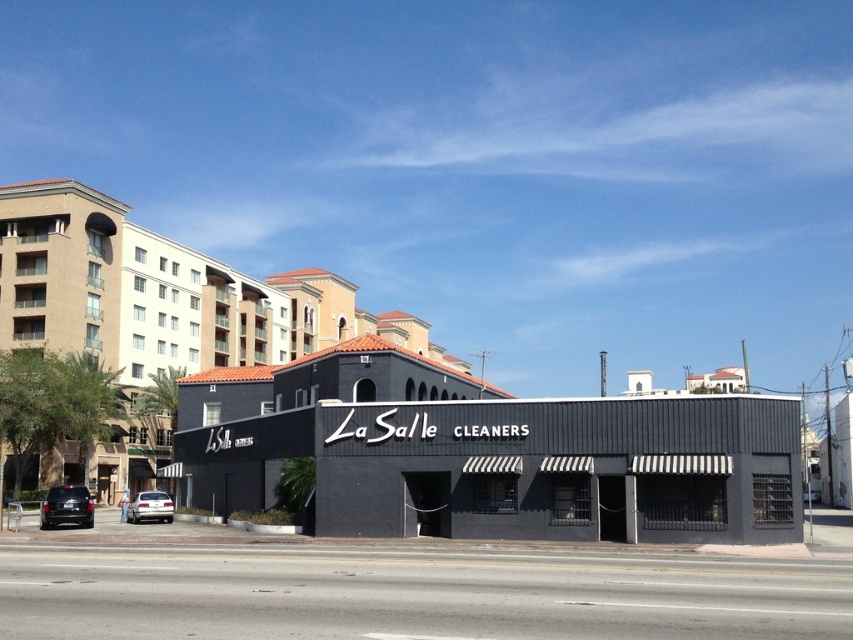
Between matte black building at center and shiny black suv at lower left, which one has less height?

shiny black suv at lower left

Can you confirm if matte black building at center is positioned to the left of shiny black suv at lower left?

No, matte black building at center is not to the left of shiny black suv at lower left.

The height and width of the screenshot is (640, 853). In order to click on matte black building at center in this screenshot , I will do `click(488, 456)`.

I want to click on matte black building at center, so click(x=488, y=456).

Can you confirm if beige stucco building at left is positioned to the right of silver metallic sedan at lower left?

Indeed, beige stucco building at left is positioned on the right side of silver metallic sedan at lower left.

Is beige stucco building at left taller than silver metallic sedan at lower left?

Yes.

Who is more distant from viewer, [386,317] or [160,492]?

The point [386,317] is more distant.

The height and width of the screenshot is (640, 853). Find the location of `beige stucco building at left`. beige stucco building at left is located at coordinates (164, 296).

Which is in front, point (376, 376) or point (165, 496)?

Positioned in front is point (376, 376).

Which is above, matte black building at center or silver metallic sedan at lower left?

Positioned higher is matte black building at center.

Between point (212, 384) and point (138, 515), which one is positioned behind?

The point (212, 384) is behind.

Find the location of a particular element. The width and height of the screenshot is (853, 640). matte black building at center is located at coordinates (488, 456).